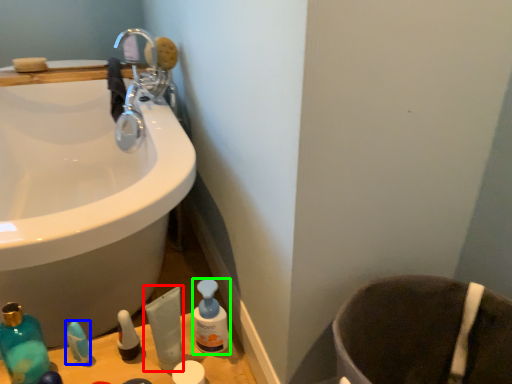
Question: Estimate the real-world distances between objects in this image. Which object is farther from toiletry (highlighted by a red box), toiletry (highlighted by a blue box) or cleaning product (highlighted by a green box)?

Choices:
 (A) toiletry
 (B) cleaning product

Answer: (A)